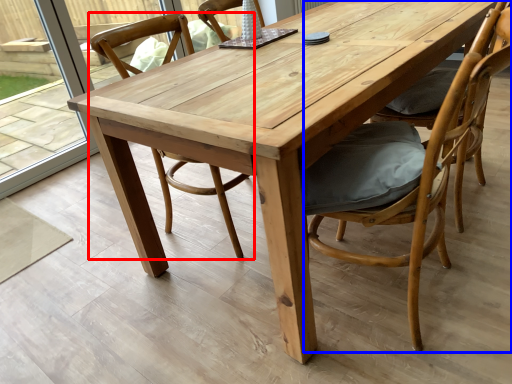
Question: Which point is further to the camera, chair (highlighted by a red box) or chair (highlighted by a blue box)?

Choices:
 (A) chair
 (B) chair

Answer: (A)